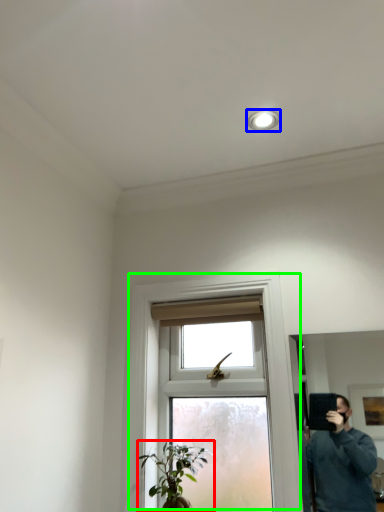
Question: Which object is the farthest from houseplant (highlighted by a red box)? Choose among these: light fixture (highlighted by a blue box) or window (highlighted by a green box).

Choices:
 (A) light fixture
 (B) window

Answer: (A)